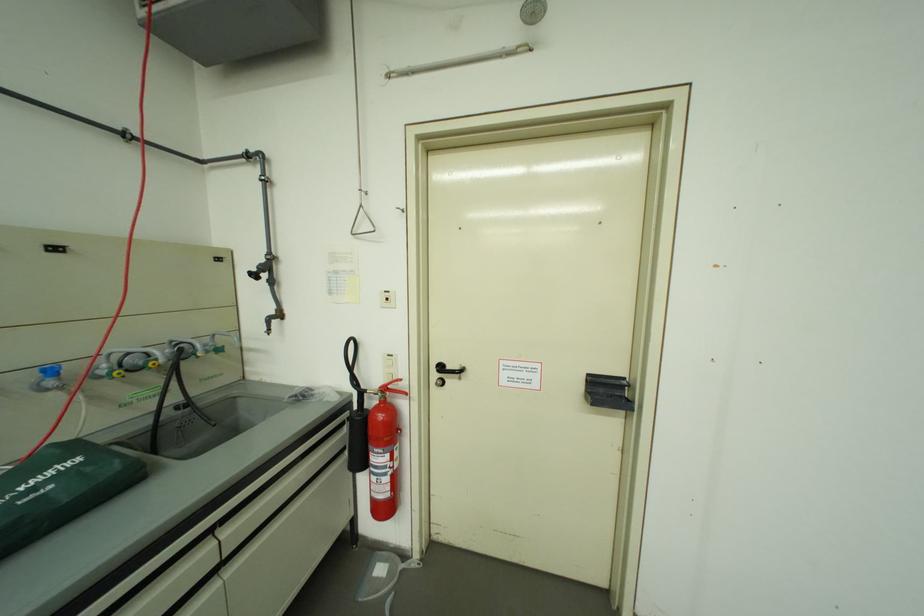
The height and width of the screenshot is (616, 924). I want to click on blue faucet knob, so click(53, 369).